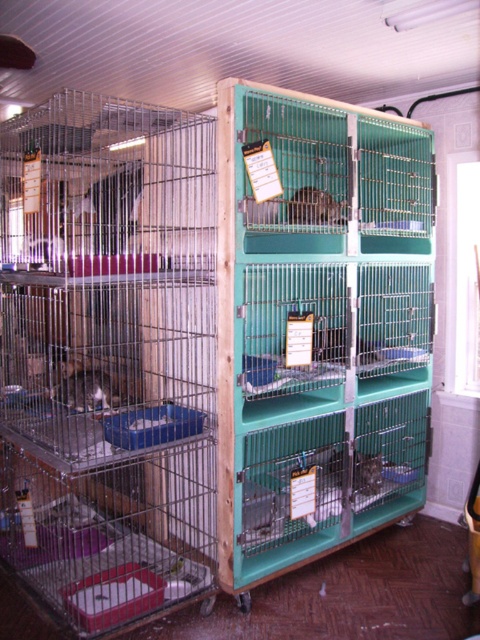
Is teal plastic cage at center behind shiny metallic cage at center?

No, teal plastic cage at center is in front of shiny metallic cage at center.

This screenshot has width=480, height=640. What do you see at coordinates (319, 326) in the screenshot?
I see `teal plastic cage at center` at bounding box center [319, 326].

Describe the element at coordinates (319, 326) in the screenshot. I see `teal plastic cage at center` at that location.

At what (x,y) coordinates should I click in order to perform the action: click on teal plastic cage at center. Please return your answer as a coordinate pair (x, y). The image size is (480, 640). Looking at the image, I should click on (319, 326).

Can you confirm if teal plastic cage at center is positioned to the right of white fur cat at left?

Indeed, teal plastic cage at center is positioned on the right side of white fur cat at left.

Is point (304, 333) farther from camera compared to point (82, 381)?

No, it is in front of (82, 381).

Locate an element on the screen. The image size is (480, 640). teal plastic cage at center is located at coordinates (319, 326).

Who is taller, matte green cage at center or shiny metallic cage at center?

shiny metallic cage at center

Is point (335, 221) positioned before point (334, 461)?

Yes, it is.

The image size is (480, 640). Find the location of `matte green cage at center`. matte green cage at center is located at coordinates (314, 208).